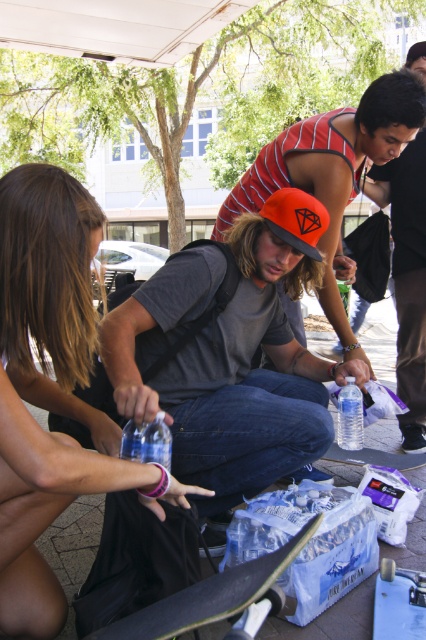
Does black matte skateboard at lower center appear on the left side of clear plastic water bottle at center?

Result: Yes, black matte skateboard at lower center is to the left of clear plastic water bottle at center.

Does black matte skateboard at lower center appear on the right side of clear plastic water bottle at center?

In fact, black matte skateboard at lower center is to the left of clear plastic water bottle at center.

What are the coordinates of `black matte skateboard at lower center` in the screenshot? It's located at (209, 596).

The width and height of the screenshot is (426, 640). Identify the location of black matte skateboard at lower center. (209, 596).

Which is more to the right, matte black hair at left or smooth black skateboard at center?

smooth black skateboard at center is more to the right.

Is matte black hair at left below smooth black skateboard at center?

Incorrect, matte black hair at left is not positioned below smooth black skateboard at center.

Who is more forward, (8,598) or (405,467)?

Point (8,598)

This screenshot has width=426, height=640. I want to click on matte black hair at left, so click(x=51, y=390).

Does orange fabric cap at center have a lesser height compared to smooth blue skateboard at lower right?

Incorrect, orange fabric cap at center's height does not fall short of smooth blue skateboard at lower right's.

Can you confirm if orange fabric cap at center is positioned above smooth blue skateboard at lower right?

Yes.

This screenshot has width=426, height=640. Describe the element at coordinates (333, 168) in the screenshot. I see `orange fabric cap at center` at that location.

Locate an element on the screen. The image size is (426, 640). orange fabric cap at center is located at coordinates click(333, 168).